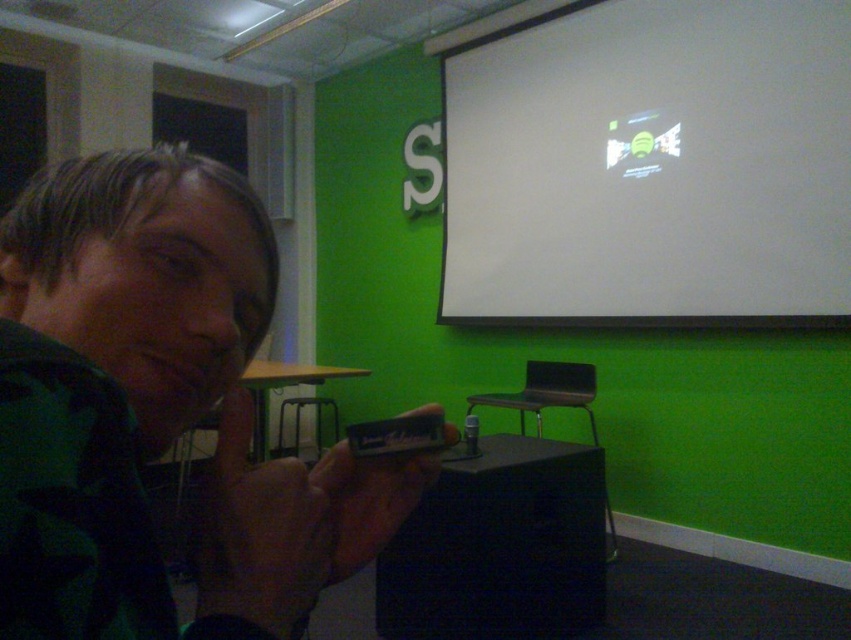
Question: Which point is closer to the camera taking this photo?

Choices:
 (A) 478,166
 (B) 112,196

Answer: (B)

Question: Is green camouflage shirt at left wider than white matte projection screen at upper center?

Choices:
 (A) yes
 (B) no

Answer: (B)

Question: Which point appears closest to the camera in this image?

Choices:
 (A) (69, 451)
 (B) (589, 259)

Answer: (A)

Question: Where is green camouflage shirt at left located in relation to white matte projection screen at upper center in the image?

Choices:
 (A) above
 (B) below

Answer: (B)

Question: Is green camouflage shirt at left bigger than white matte projection screen at upper center?

Choices:
 (A) yes
 (B) no

Answer: (B)